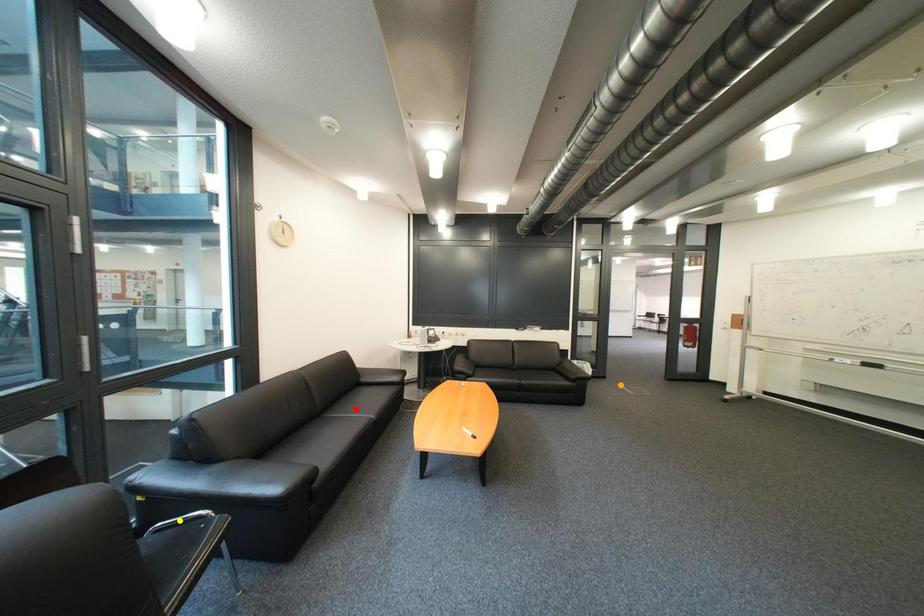
Order these from nearest to farthest:
yellow point
orange point
red point

yellow point
red point
orange point